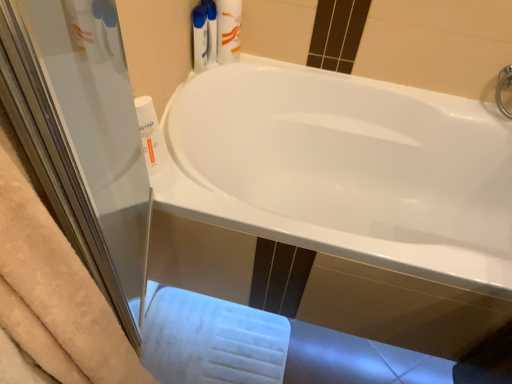
Question: Is white plastic bottle at left, which is the first cleaning product from left to right, further to the viewer compared to white glossy bathtub at center?

Choices:
 (A) no
 (B) yes

Answer: (B)

Question: Is white plastic bottle at left, the 2th cleaning product positioned from the right, smaller than white glossy bathtub at center?

Choices:
 (A) no
 (B) yes

Answer: (B)

Question: Is white plastic bottle at left, the first cleaning product from the bottom, placed right next to white glossy bathtub at center?

Choices:
 (A) yes
 (B) no

Answer: (B)

Question: Are white plastic bottle at left, which is counted as the second cleaning product, starting from the top, and white glossy bathtub at center located far from each other?

Choices:
 (A) yes
 (B) no

Answer: (B)

Question: Is white plastic bottle at left, the first cleaning product from the bottom, outside white glossy bathtub at center?

Choices:
 (A) yes
 (B) no

Answer: (A)

Question: From the image's perspective, is white plastic bottle at left, the first cleaning product from the bottom, located above or below white plastic bottle at upper center, which appears as the 1th cleaning product when viewed from the right?

Choices:
 (A) below
 (B) above

Answer: (A)

Question: From a real-world perspective, is white plastic bottle at left, the 2th cleaning product when ordered from back to front, above or below white plastic bottle at upper center, which appears as the 1th cleaning product when viewed from the right?

Choices:
 (A) below
 (B) above

Answer: (A)

Question: Does point (155, 167) appear closer or farther from the camera than point (205, 48)?

Choices:
 (A) farther
 (B) closer

Answer: (B)

Question: In the image, is white plastic bottle at left, positioned as the first cleaning product in front-to-back order, positioned in front of or behind white plastic bottle at upper center, the second cleaning product positioned from the left?

Choices:
 (A) behind
 (B) front

Answer: (B)

Question: From the image's perspective, is white plastic bottle at left, the first cleaning product from the bottom, above or below white plastic tube at upper center?

Choices:
 (A) above
 (B) below

Answer: (B)

Question: From a real-world perspective, is white plastic bottle at left, which is the first cleaning product from left to right, above or below white plastic tube at upper center?

Choices:
 (A) below
 (B) above

Answer: (A)

Question: Relative to white plastic tube at upper center, is white plastic bottle at left, the 2th cleaning product positioned from the right, in front or behind?

Choices:
 (A) behind
 (B) front

Answer: (B)

Question: Considering the positions of white plastic bottle at left, positioned as the first cleaning product in front-to-back order, and white plastic tube at upper center in the image, is white plastic bottle at left, positioned as the first cleaning product in front-to-back order, wider or thinner than white plastic tube at upper center?

Choices:
 (A) wide
 (B) thin

Answer: (B)

Question: Is white glossy bathtub at center situated inside white plastic bottle at left, positioned as the first cleaning product in front-to-back order, or outside?

Choices:
 (A) inside
 (B) outside

Answer: (B)

Question: From the image's perspective, is white glossy bathtub at center positioned above or below white plastic bottle at left, which is the first cleaning product from left to right?

Choices:
 (A) above
 (B) below

Answer: (B)